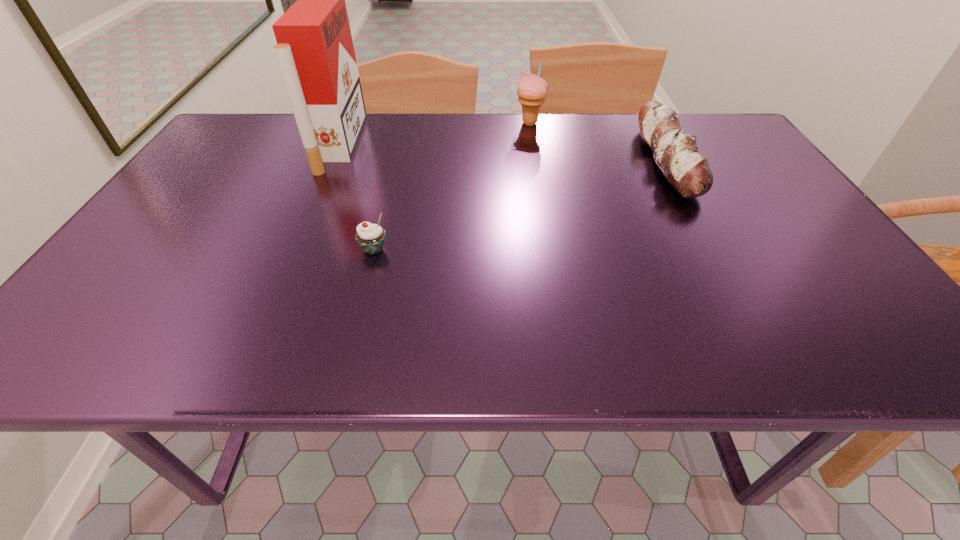
Locate an element on the screen. The image size is (960, 540). object identified as the second closest to the rightmost object is located at coordinates (370, 237).

In order to click on vacant position in the image that satisfies the following two spatial constraints: 1. on the front side of the third object from left to right; 2. on the front-facing side of the leftmost object in this screenshot , I will do `click(533, 144)`.

Where is `free spot that satisfies the following two spatial constraints: 1. on the front-facing side of the cigarette case; 2. on the right side of the nearest object`? This screenshot has width=960, height=540. free spot that satisfies the following two spatial constraints: 1. on the front-facing side of the cigarette case; 2. on the right side of the nearest object is located at coordinates [294, 249].

Find the location of `blank space that satisfies the following two spatial constraints: 1. on the front-facing side of the nearest object; 2. on the right side of the leftmost object`. blank space that satisfies the following two spatial constraints: 1. on the front-facing side of the nearest object; 2. on the right side of the leftmost object is located at coordinates (294, 249).

At what (x,y) coordinates should I click in order to perform the action: click on vacant position in the image that satisfies the following two spatial constraints: 1. on the front-facing side of the leftmost object; 2. on the back side of the rightmost object. Please return your answer as a coordinate pair (x, y). The height and width of the screenshot is (540, 960). Looking at the image, I should click on (332, 161).

In order to click on free location that satisfies the following two spatial constraints: 1. on the front-facing side of the cigarette case; 2. on the back side of the cupcake in this screenshot , I will do `click(294, 249)`.